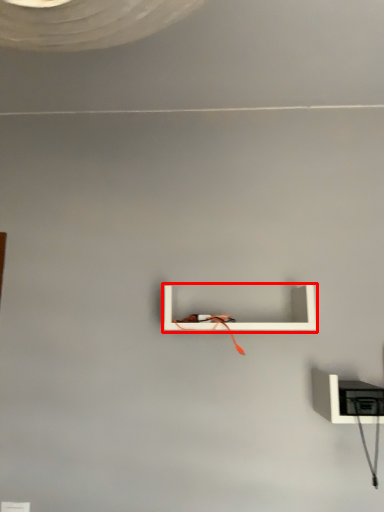
Question: From the image's perspective, what is the correct spatial relationship of shelf (annotated by the red box) in relation to shelf?

Choices:
 (A) below
 (B) above

Answer: (B)